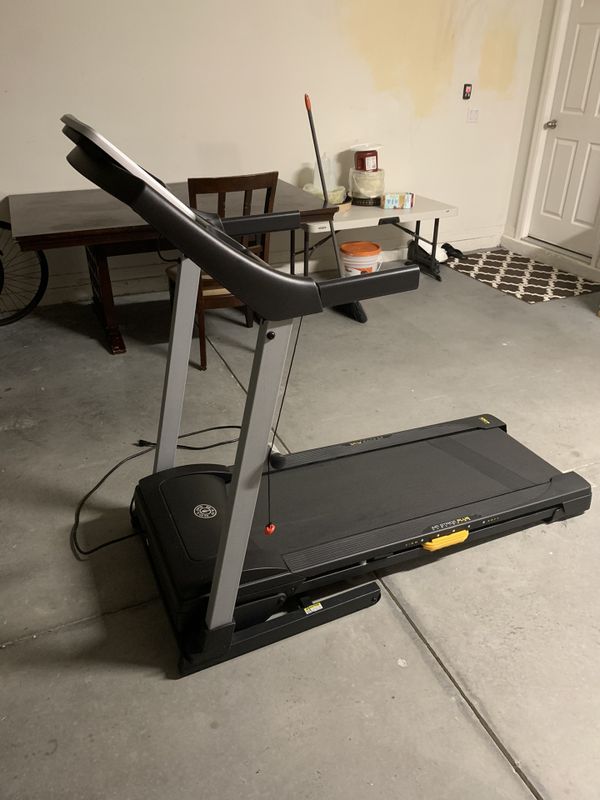
Identify the location of treadmill. (371, 474).